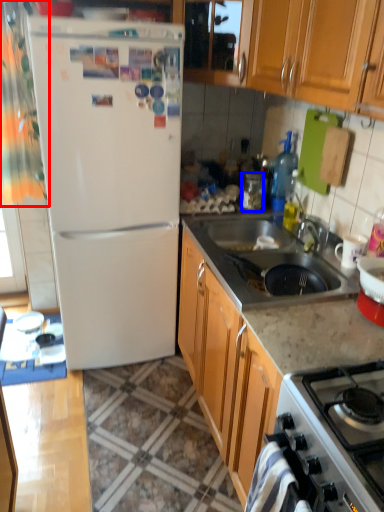
Question: Which point is further to the camera, curtain (highlighted by a red box) or appliance (highlighted by a blue box)?

Choices:
 (A) curtain
 (B) appliance

Answer: (B)